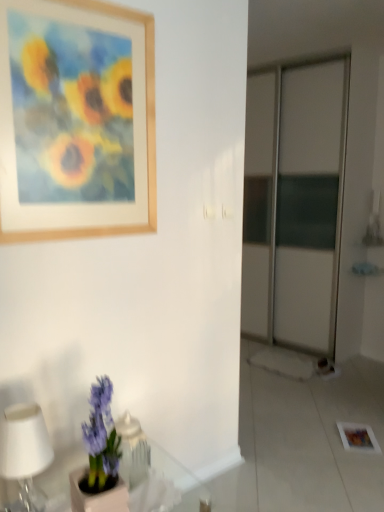
Question: From a real-world perspective, is translucent glass table at lower left located higher than purple matte hyacinth at lower left?

Choices:
 (A) yes
 (B) no

Answer: (B)

Question: From the image's perspective, does translucent glass table at lower left appear lower than purple matte hyacinth at lower left?

Choices:
 (A) yes
 (B) no

Answer: (A)

Question: Can you confirm if translucent glass table at lower left is taller than purple matte hyacinth at lower left?

Choices:
 (A) yes
 (B) no

Answer: (B)

Question: Is purple matte hyacinth at lower left at the back of translucent glass table at lower left?

Choices:
 (A) yes
 (B) no

Answer: (B)

Question: Could you tell me if translucent glass table at lower left is facing purple matte hyacinth at lower left?

Choices:
 (A) no
 (B) yes

Answer: (A)

Question: From their relative heights in the image, would you say wooden picture frame at upper left is taller or shorter than translucent glass table at lower left?

Choices:
 (A) short
 (B) tall

Answer: (B)

Question: Based on their sizes in the image, would you say wooden picture frame at upper left is bigger or smaller than translucent glass table at lower left?

Choices:
 (A) small
 (B) big

Answer: (A)

Question: From the image's perspective, is wooden picture frame at upper left located above or below translucent glass table at lower left?

Choices:
 (A) above
 (B) below

Answer: (A)

Question: Is wooden picture frame at upper left situated inside translucent glass table at lower left or outside?

Choices:
 (A) outside
 (B) inside

Answer: (A)

Question: Which is correct: purple matte hyacinth at lower left is inside wooden picture frame at upper left, or outside of it?

Choices:
 (A) outside
 (B) inside

Answer: (A)

Question: Is purple matte hyacinth at lower left bigger or smaller than wooden picture frame at upper left?

Choices:
 (A) big
 (B) small

Answer: (B)

Question: In the image, is purple matte hyacinth at lower left positioned in front of or behind wooden picture frame at upper left?

Choices:
 (A) behind
 (B) front

Answer: (B)

Question: Does point (107, 404) appear closer or farther from the camera than point (135, 64)?

Choices:
 (A) farther
 (B) closer

Answer: (B)

Question: Which is correct: white matte table lamp at lower left is inside purple matte hyacinth at lower left, or outside of it?

Choices:
 (A) inside
 (B) outside

Answer: (B)

Question: Is white matte table lamp at lower left bigger or smaller than purple matte hyacinth at lower left?

Choices:
 (A) small
 (B) big

Answer: (A)